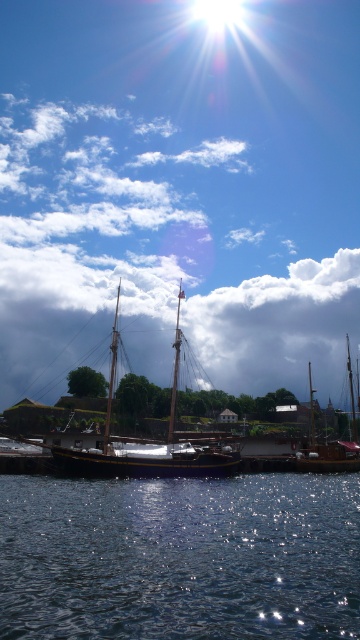
Question: Which object is the closest to the wooden mast at center?

Choices:
 (A) matte wooden boat at center
 (B) shiny silver mast at center
 (C) smooth wood mast at center
 (D) cloudy sky at center

Answer: (B)

Question: Which point is farther to the camera?

Choices:
 (A) wooden mast at center
 (B) smooth wood mast at center
 (C) wooden sailboat at center
 (D) glistening dark water at lower center

Answer: (B)

Question: Is glistening dark water at lower center smaller than wooden mast at center?

Choices:
 (A) yes
 (B) no

Answer: (A)

Question: Can you confirm if matte wooden boat at center is positioned below shiny silver mast at center?

Choices:
 (A) no
 (B) yes

Answer: (A)

Question: Which object appears closest to the camera in this image?

Choices:
 (A) shiny silver mast at center
 (B) cloudy sky at center
 (C) wooden mast at center
 (D) wooden sailboat at center

Answer: (D)

Question: Does wooden mast at center appear on the left side of shiny silver mast at center?

Choices:
 (A) no
 (B) yes

Answer: (B)